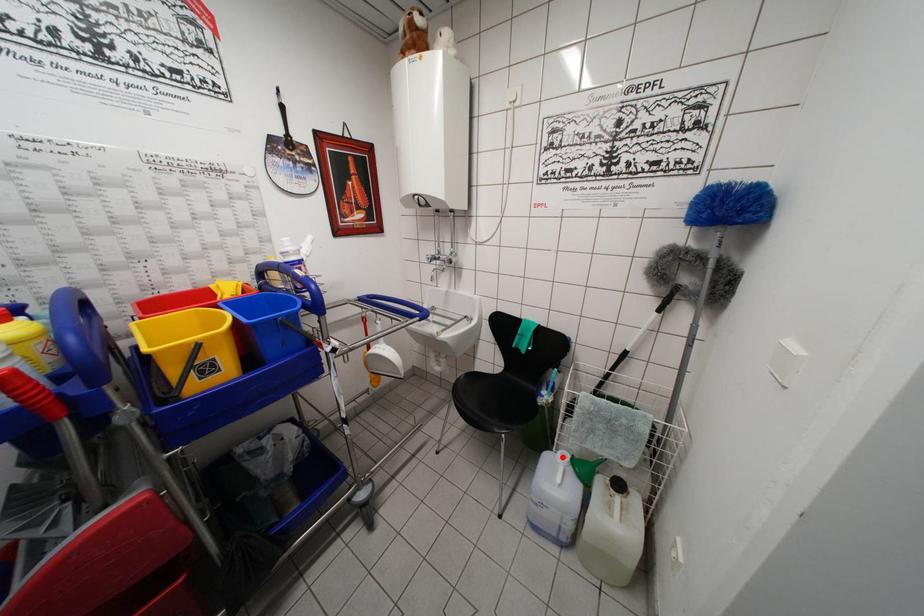
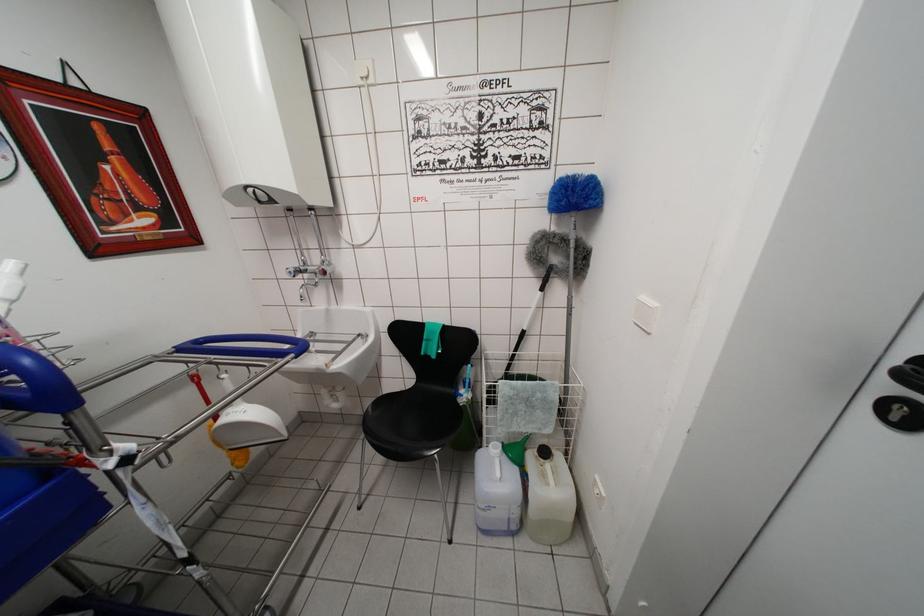
Find the pixel in the second image that matches the highlighted location in the first image.

(493, 450)